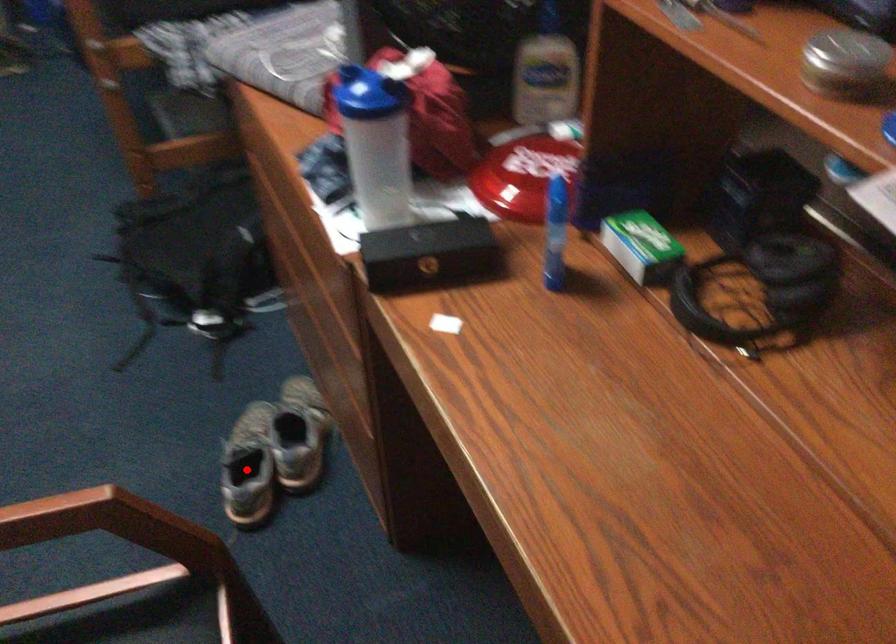
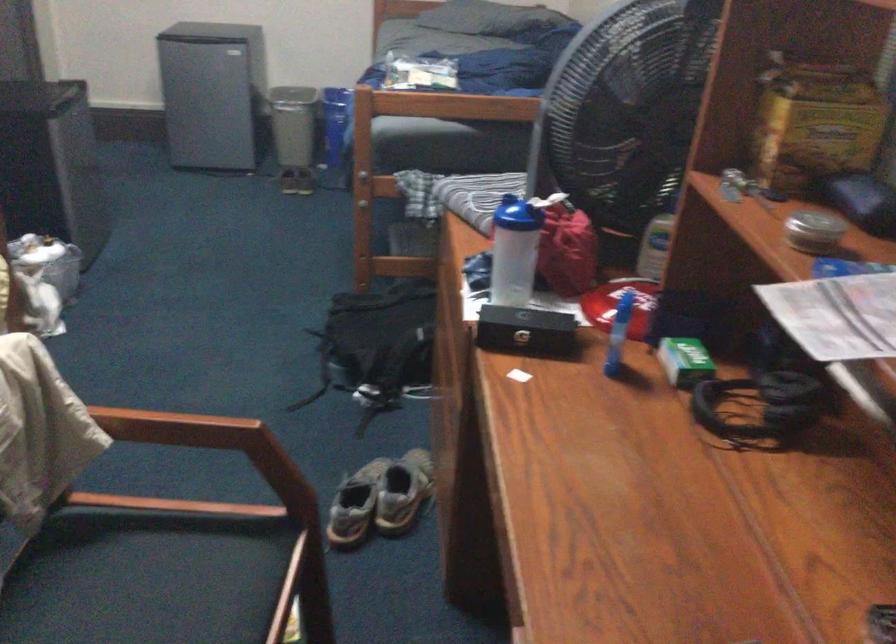
Find the pixel in the second image that matches the highlighted location in the first image.

(355, 505)